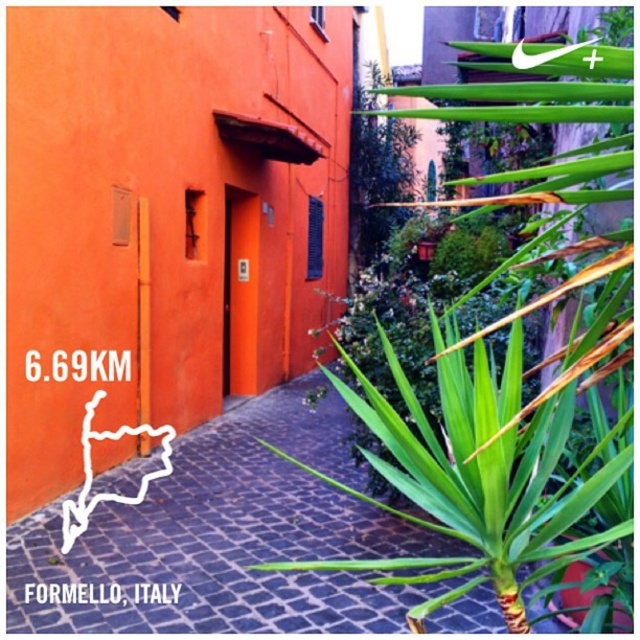
From the picture: Is green leafy plant at center right to the left of green leafy plant at lower right from the viewer's perspective?

No, green leafy plant at center right is not to the left of green leafy plant at lower right.

Does green leafy plant at center right have a smaller size compared to green leafy plant at lower right?

No.

I want to click on green leafy plant at center right, so click(493, 448).